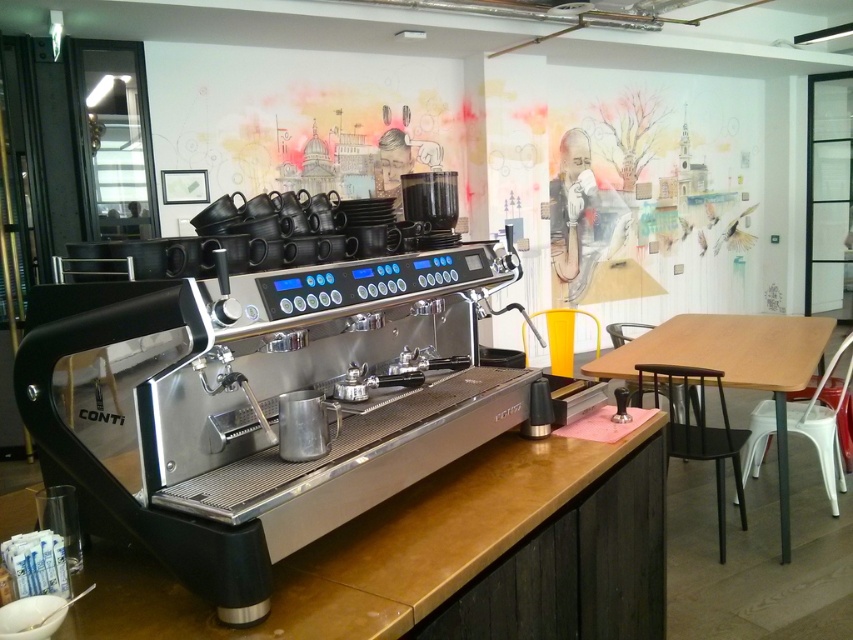
Question: Is wooden countertop at center positioned at the back of smooth skin at upper center?

Choices:
 (A) no
 (B) yes

Answer: (A)

Question: From the image, what is the correct spatial relationship of wooden countertop at center in relation to smooth skin at upper center?

Choices:
 (A) above
 (B) below

Answer: (B)

Question: Does wooden table at right have a lesser width compared to smooth skin at upper center?

Choices:
 (A) no
 (B) yes

Answer: (A)

Question: Which object is positioned farthest from the wooden countertop at center?

Choices:
 (A) black matte stool at lower right
 (B) wooden table at right
 (C) smooth skin at upper center

Answer: (C)

Question: Estimate the real-world distances between objects in this image. Which object is closer to the wooden countertop at center?

Choices:
 (A) wooden table at right
 (B) smooth skin at upper center

Answer: (A)

Question: Which object appears farthest from the camera in this image?

Choices:
 (A) wooden table at right
 (B) smooth skin at upper center
 (C) wooden countertop at center
 (D) black matte stool at lower right

Answer: (B)